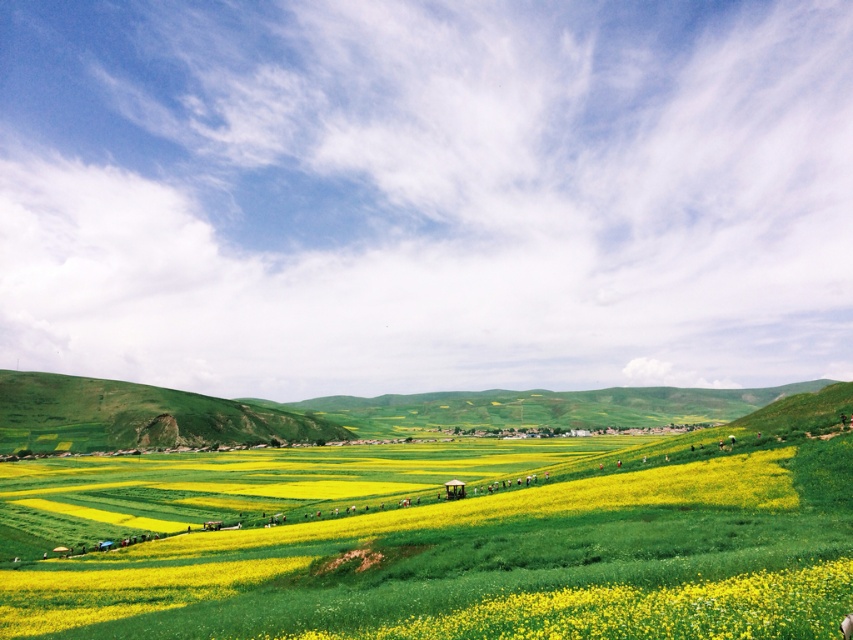
Question: Can you confirm if yellow matte flower at center is bigger than green grassy hillside at left?

Choices:
 (A) yes
 (B) no

Answer: (B)

Question: From the image, what is the correct spatial relationship of yellow matte flower at center in relation to green grassy hillside at left?

Choices:
 (A) below
 (B) above

Answer: (B)

Question: Does yellow matte flower at center appear over green grassy hillside at left?

Choices:
 (A) yes
 (B) no

Answer: (A)